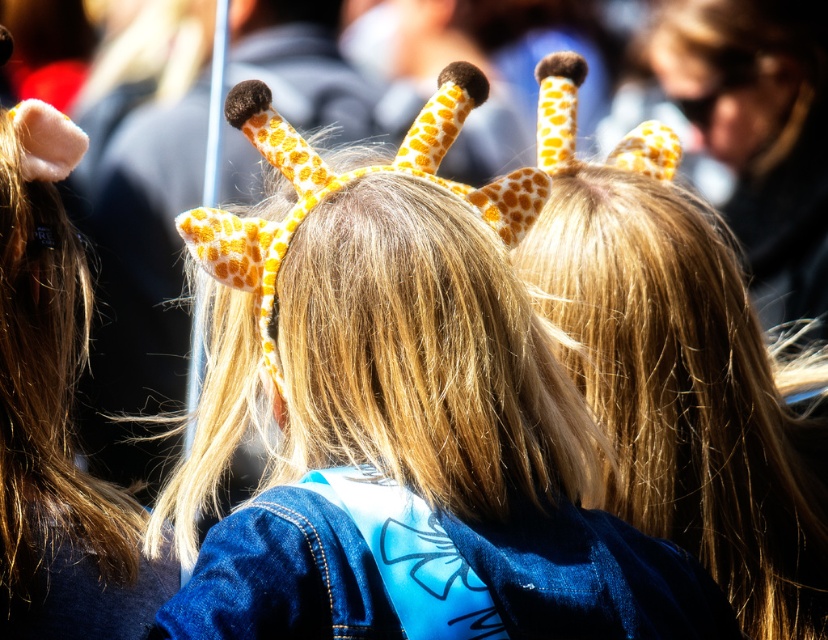
Question: Is the position of matte yellow giraffe headband at center more distant than that of blonde silky hair at center?

Choices:
 (A) yes
 (B) no

Answer: (B)

Question: Which of the following is the farthest from the observer?

Choices:
 (A) yellow dotted fabric giraffe ears at upper center
 (B) denim jacket at lower right

Answer: (A)

Question: Which object is closer to the camera taking this photo?

Choices:
 (A) blonde silky hair at center
 (B) denim jacket at lower right
 (C) matte yellow giraffe headband at center

Answer: (B)

Question: Which point is closer to the camera taking this photo?

Choices:
 (A) [x=403, y=614]
 (B) [x=644, y=397]
 (C) [x=689, y=84]
 (D) [x=398, y=400]

Answer: (A)

Question: Does blonde silky hair at center appear over yellow dotted fabric giraffe ears at upper center?

Choices:
 (A) yes
 (B) no

Answer: (B)

Question: Does matte yellow giraffe headband at center have a greater width compared to yellow dotted fabric giraffe ears at upper center?

Choices:
 (A) no
 (B) yes

Answer: (B)